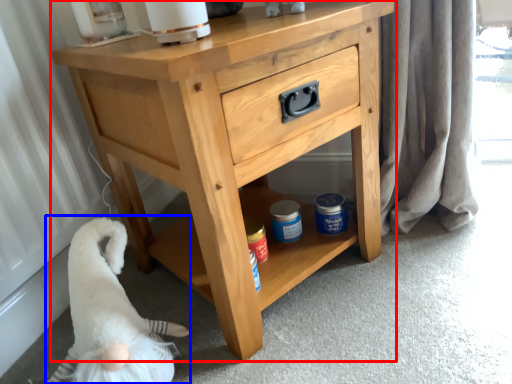
Question: Among these objects, which one is farthest to the camera, chest of drawers (highlighted by a red box) or animal (highlighted by a blue box)?

Choices:
 (A) chest of drawers
 (B) animal

Answer: (B)